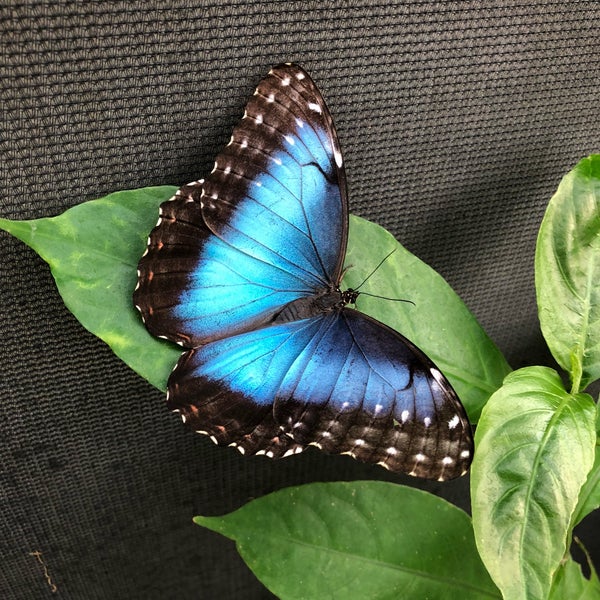
Image resolution: width=600 pixels, height=600 pixels. I want to click on wall, so click(449, 135).